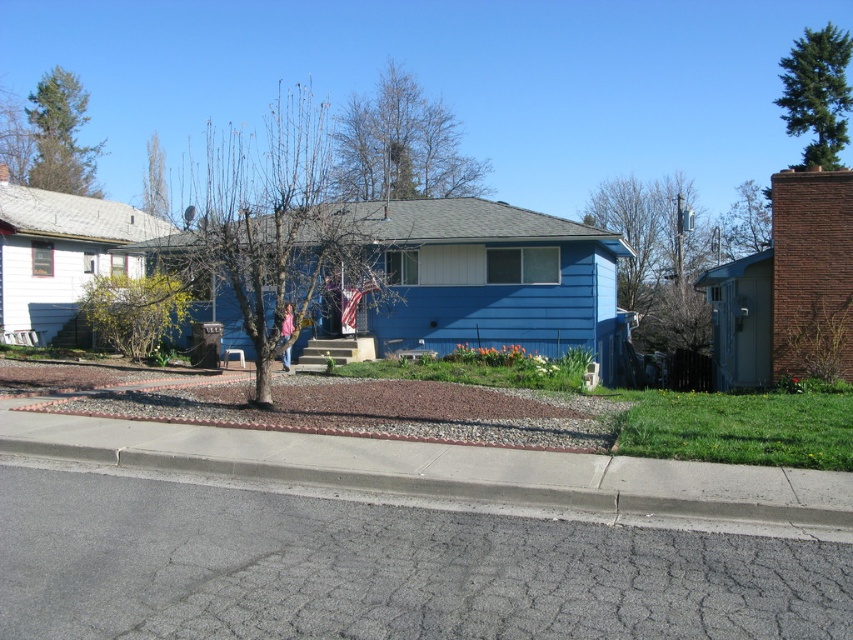
Question: Which point is farther to the camera?

Choices:
 (A) (248, 294)
 (B) (45, 177)
 (C) (732, 257)

Answer: (C)

Question: Which of these objects is positioned closest to the yellow-green foliage at center-left?

Choices:
 (A) bare branches at upper center
 (B) green textured tree at upper right
 (C) green leafy tree at upper center
 (D) bare branches at center

Answer: (D)

Question: In this image, where is gray concrete curb at lower center located relative to green leafy tree at upper center?

Choices:
 (A) below
 (B) above

Answer: (A)

Question: In this image, where is yellow-green foliage at center-left located relative to green leafy tree at upper right?

Choices:
 (A) above
 (B) below

Answer: (B)

Question: Can you confirm if bare branches at center is smaller than green leafy tree at upper center?

Choices:
 (A) no
 (B) yes

Answer: (A)

Question: Which point appears closest to the camera in this image?

Choices:
 (A) (828, 58)
 (B) (276, 483)
 (C) (369, 154)

Answer: (B)